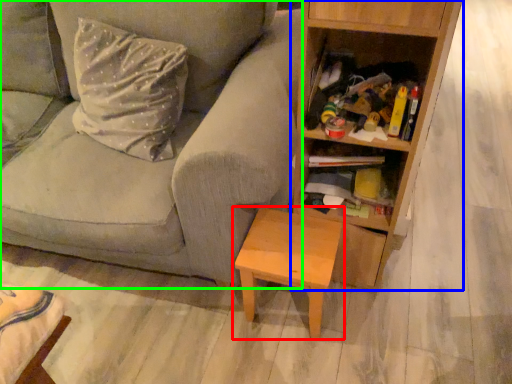
Question: Which object is positioned closest to table (highlighted by a red box)? Select from bookcase (highlighted by a blue box) and studio couch (highlighted by a green box).

Choices:
 (A) bookcase
 (B) studio couch

Answer: (A)